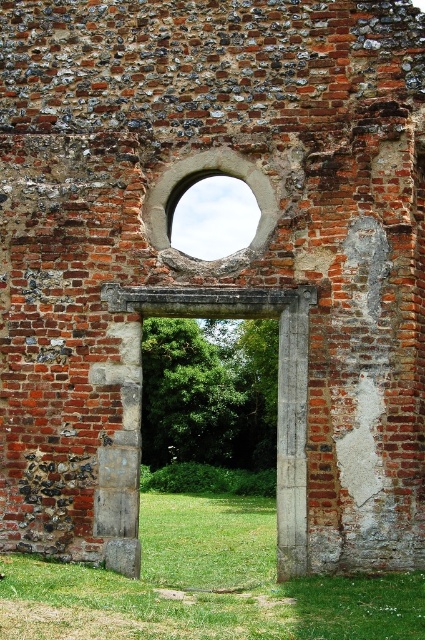
Does green grass at lower center appear under smooth stone archway at center?

Indeed, green grass at lower center is positioned under smooth stone archway at center.

Is the position of green grass at lower center less distant than that of smooth stone archway at center?

Yes, it is in front of smooth stone archway at center.

Is point (238, 632) less distant than point (238, 156)?

Yes.

This screenshot has height=640, width=425. I want to click on green grass at lower center, so click(204, 586).